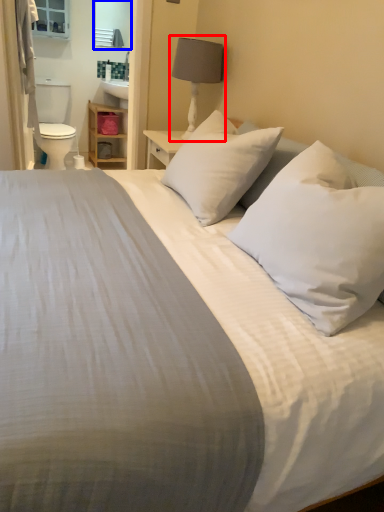
Question: Among these objects, which one is farthest to the camera, bedside lamp (highlighted by a red box) or mirror (highlighted by a blue box)?

Choices:
 (A) bedside lamp
 (B) mirror

Answer: (B)